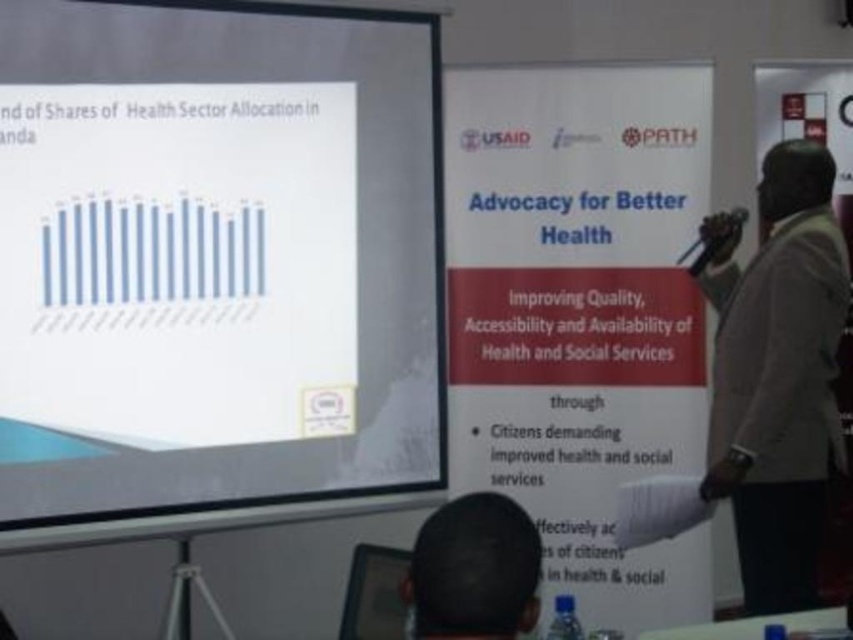
Locate an element on the screen. The image size is (853, 640). white matte projection screen at upper left is located at coordinates (216, 266).

The height and width of the screenshot is (640, 853). Find the location of `white matte projection screen at upper left`. white matte projection screen at upper left is located at coordinates (216, 266).

You are a GUI agent. You are given a task and a screenshot of the screen. Output one action in this format:
    pyautogui.click(x=<x>, y=<y>)
    Task: Click on the white matte projection screen at upper left
    The height and width of the screenshot is (640, 853).
    Given the screenshot: What is the action you would take?
    (x=216, y=266)

Between white matte projection screen at upper left and dark hair at lower center, which one has more height?

Standing taller between the two is white matte projection screen at upper left.

Between point (181, 387) and point (433, 518), which one is positioned behind?

The point (181, 387) is more distant.

Is point (363, 51) positioned after point (469, 620)?

Yes, it is.

Where is `white matte projection screen at upper left`? white matte projection screen at upper left is located at coordinates (216, 266).

Is point (804, 168) in front of point (416, 545)?

No, (804, 168) is behind (416, 545).

Is brown fabric jacket at right smaller than dark hair at lower center?

Actually, brown fabric jacket at right might be larger than dark hair at lower center.

Which is in front, point (724, 323) or point (450, 564)?

Point (450, 564) is in front.

This screenshot has height=640, width=853. I want to click on brown fabric jacket at right, so click(x=776, y=374).